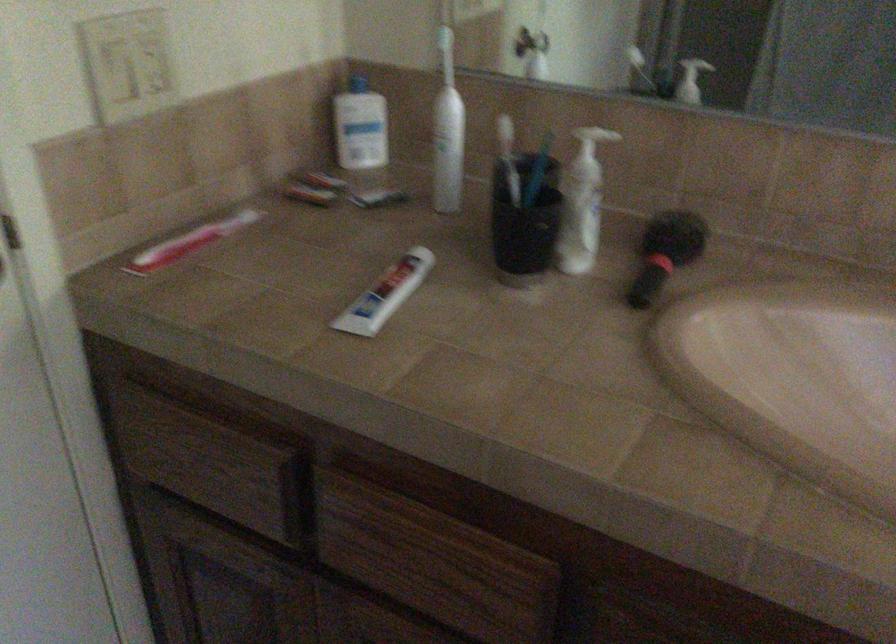
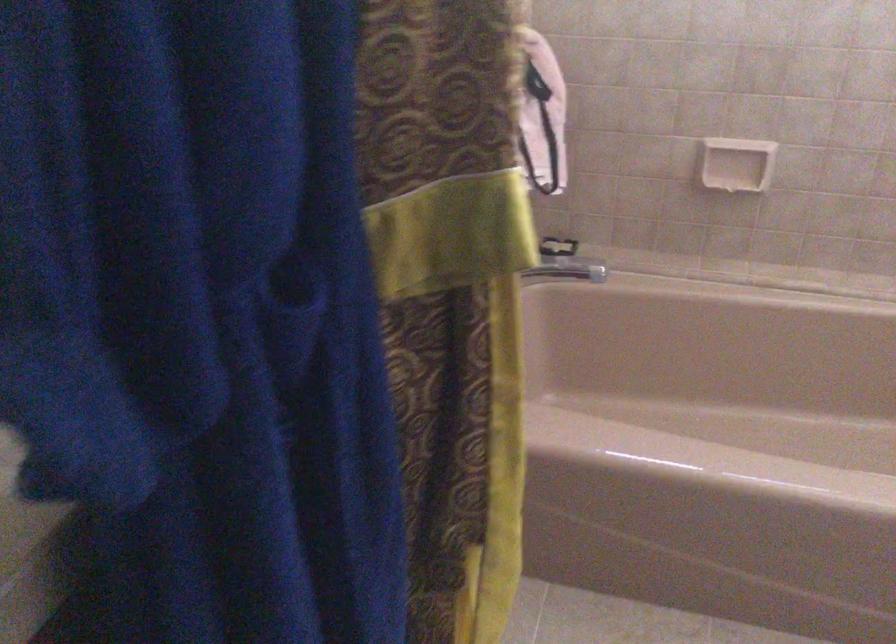
The first image is from the beginning of the video and the second image is from the end. How did the camera likely rotate when shooting the video?

The camera's rotation is toward right-down.